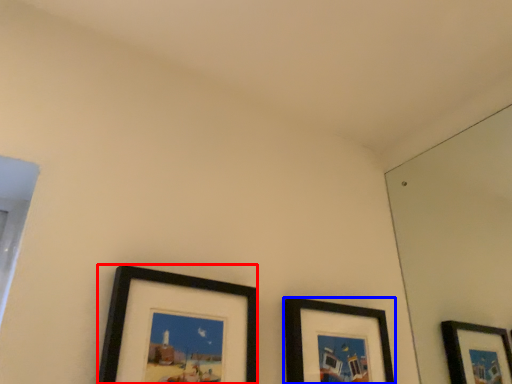
Question: Among these objects, which one is farthest to the camera, picture frame (highlighted by a red box) or picture frame (highlighted by a blue box)?

Choices:
 (A) picture frame
 (B) picture frame

Answer: (B)